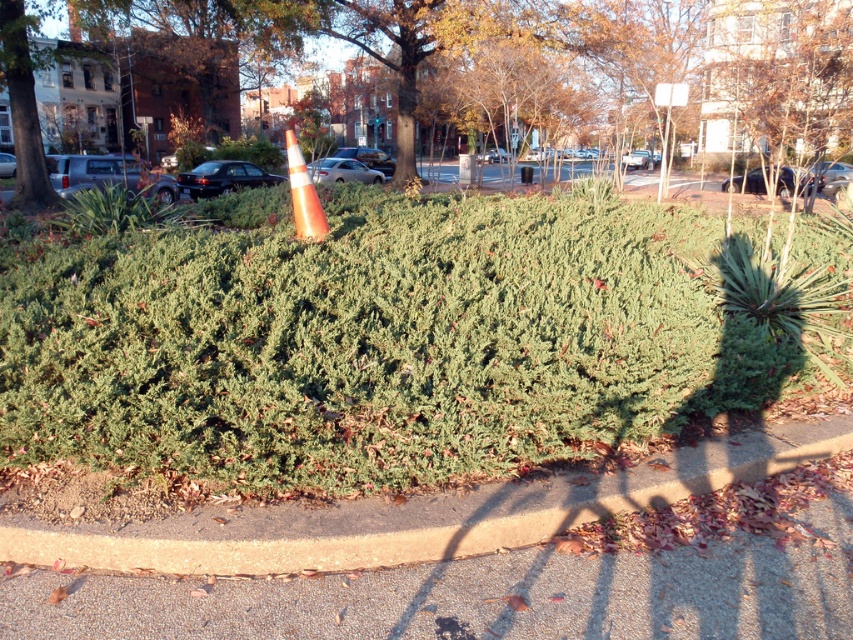
Which is above, concrete curb at lower center or orange reflective cone at center?

orange reflective cone at center is higher up.

Between concrete curb at lower center and orange reflective cone at center, which one appears on the left side from the viewer's perspective?

orange reflective cone at center is more to the left.

Locate an element on the screen. This screenshot has width=853, height=640. concrete curb at lower center is located at coordinates (415, 515).

Locate an element on the screen. The image size is (853, 640). concrete curb at lower center is located at coordinates (415, 515).

Between point (839, 8) and point (415, 512), which one is positioned behind?

The point (839, 8) is behind.

Between point (624, 125) and point (335, 522), which one is positioned in front?

Point (335, 522)

At what (x,y) coordinates should I click in order to perform the action: click on green leafy bush at center. Please return your answer as a coordinate pair (x, y). This screenshot has height=640, width=853. Looking at the image, I should click on (509, 56).

Does green leafy bush at center appear on the left side of orange reflective cone at center?

In fact, green leafy bush at center is to the right of orange reflective cone at center.

How far apart are green leafy bush at center and orange reflective cone at center?

They are 61.84 feet apart.

Who is more distant from viewer, (409, 152) or (289, 161)?

Point (409, 152)

Image resolution: width=853 pixels, height=640 pixels. Identify the location of green leafy bush at center. (509, 56).